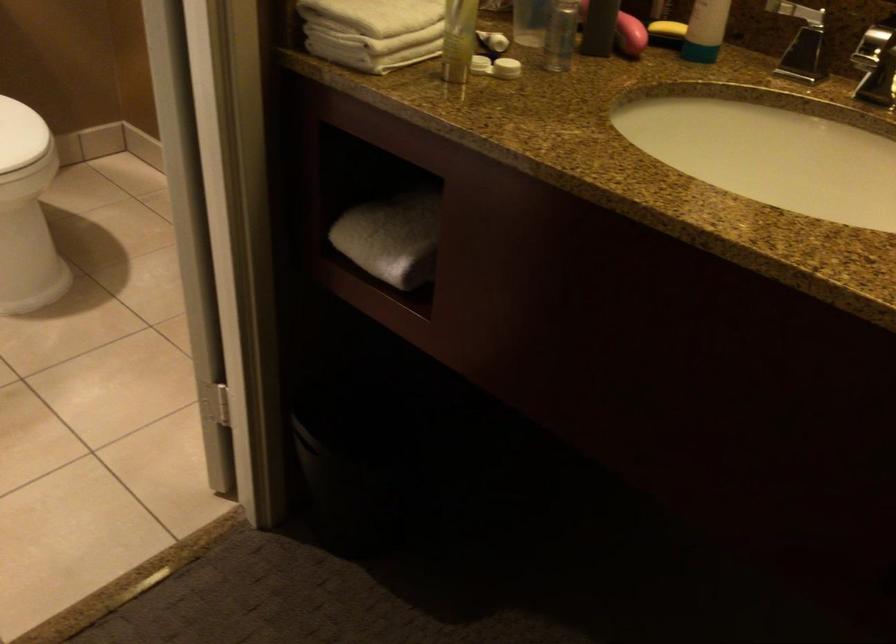
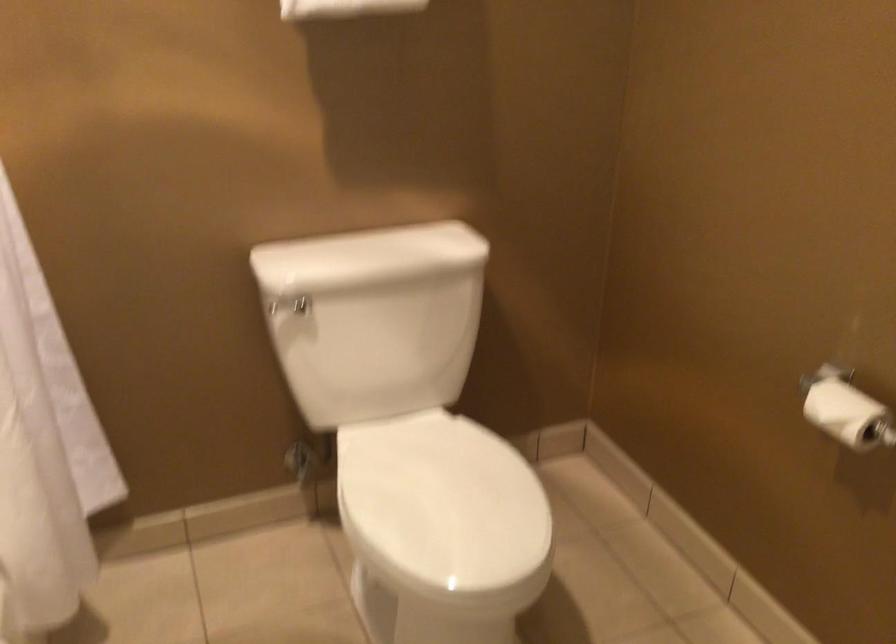
Question: The camera is either moving clockwise (left) or counter-clockwise (right) around the object. The first image is from the beginning of the video and the second image is from the end. Is the camera moving left or right when shooting the video?

Choices:
 (A) Left
 (B) Right

Answer: (B)